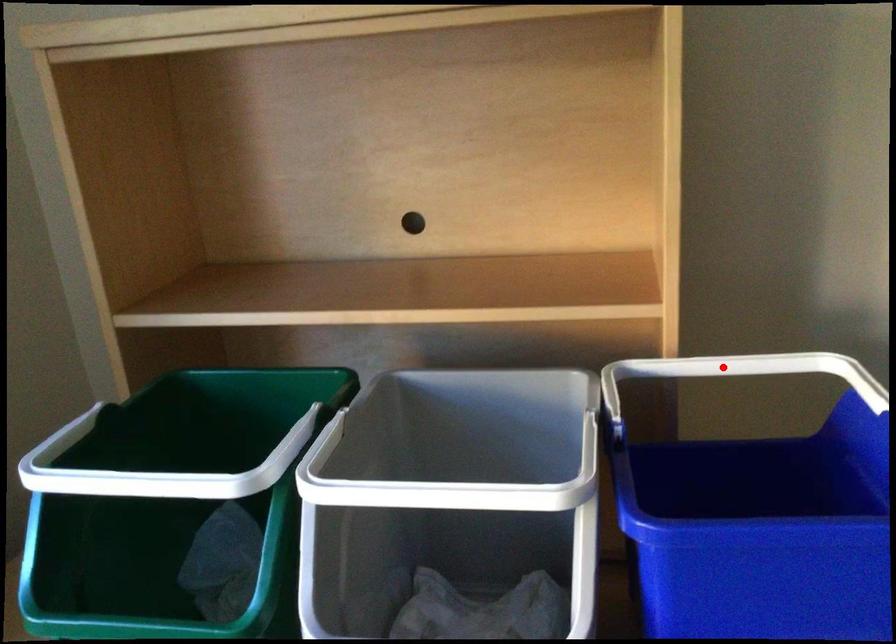
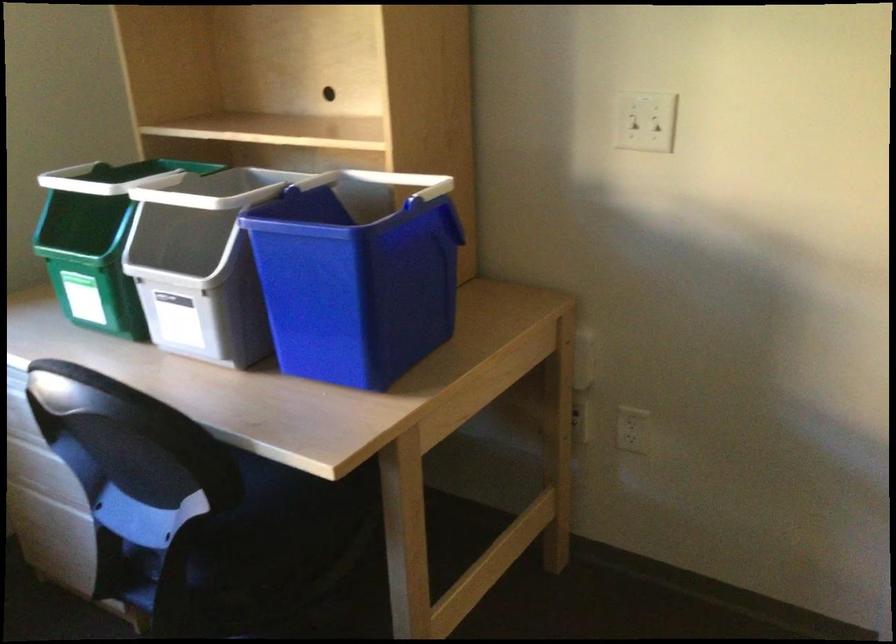
Question: I am providing you with two images of the same scene from different viewpoints. Given a red point in image1, look at the same physical point in image2. Is it:

Choices:
 (A) Closer to the viewpoint
 (B) Farther from the viewpoint

Answer: (B)